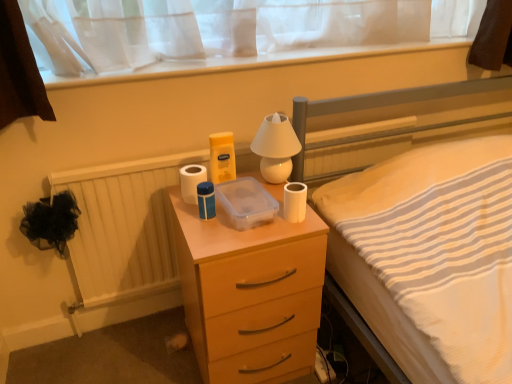
This screenshot has width=512, height=384. What are the coordinates of `free space to the left of white matte toilet paper at right, which is the second toilet paper in back-to-front order` in the screenshot? It's located at (241, 231).